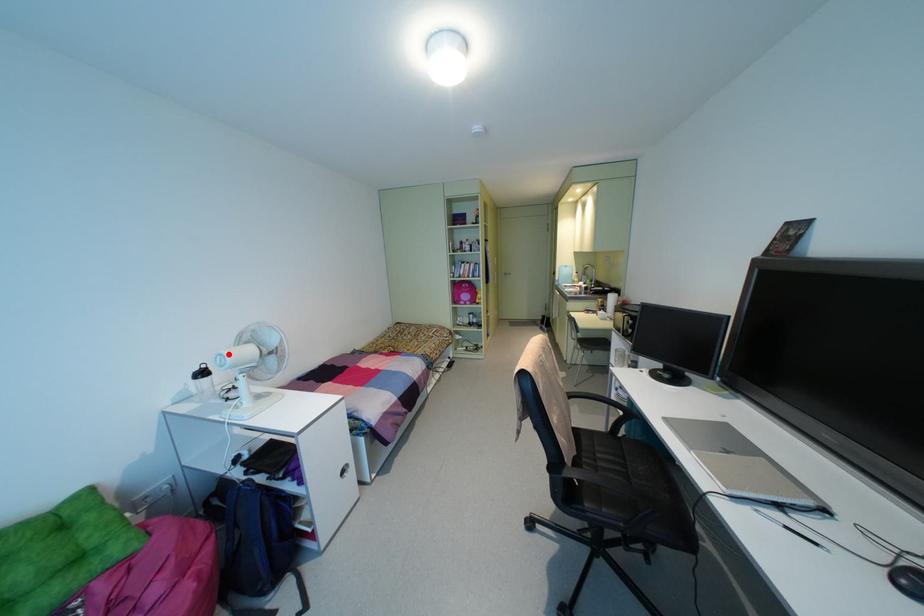
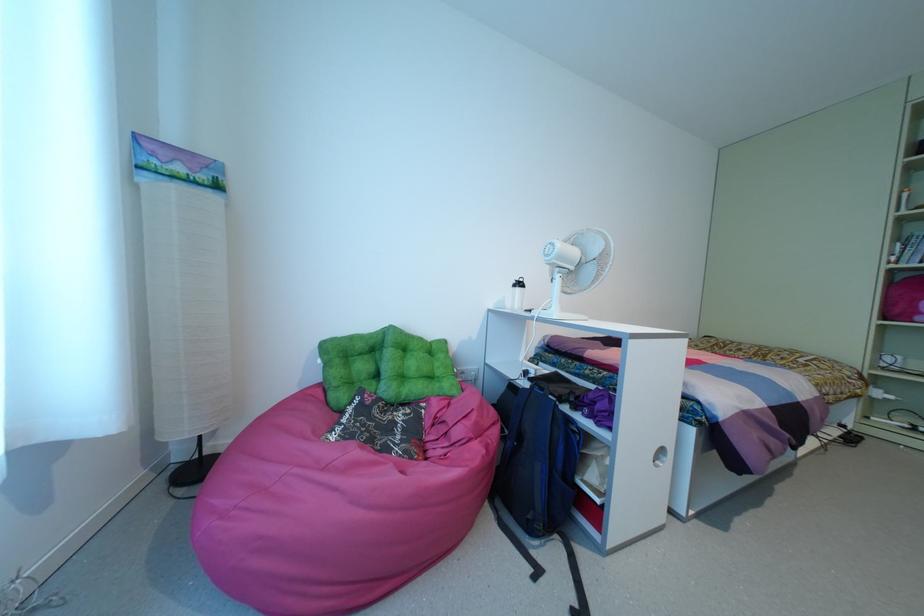
Where in the second image is the point corresponding to the highlighted location from the first image?

(556, 244)